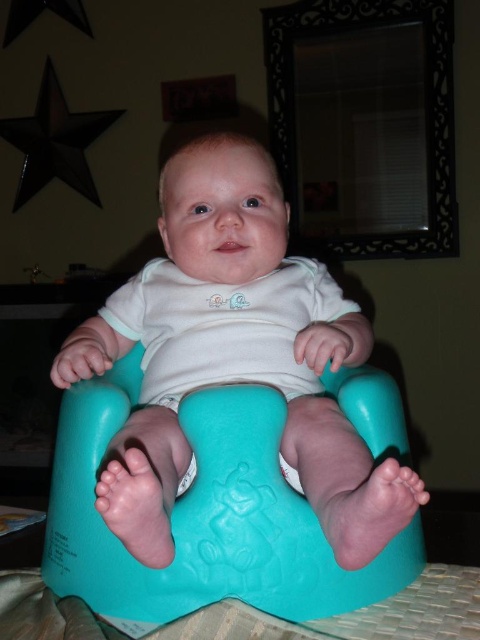
You are a parent trying to clean up the playroom. You see the teal rubber potty at center and the teal plastic feeding chair at center. Which one should you pick up first if you want to start with the item that is nearest to you?

The teal rubber potty at center is closer to the viewer, so you should pick up the teal rubber potty at center first.

From the picture: You are a parent trying to organize the nursery. You have a teal rubber potty at center and a teal plastic feeding chair at center. If you want to place them side by side, will they fit within a 5.5 inch wide shelf?

The teal rubber potty at center is 2.79 inches from the teal plastic feeding chair at center, so combined they would require approximately 5.58 inches of space. Since the shelf is only 5.5 inches wide, they will not fit side by side.